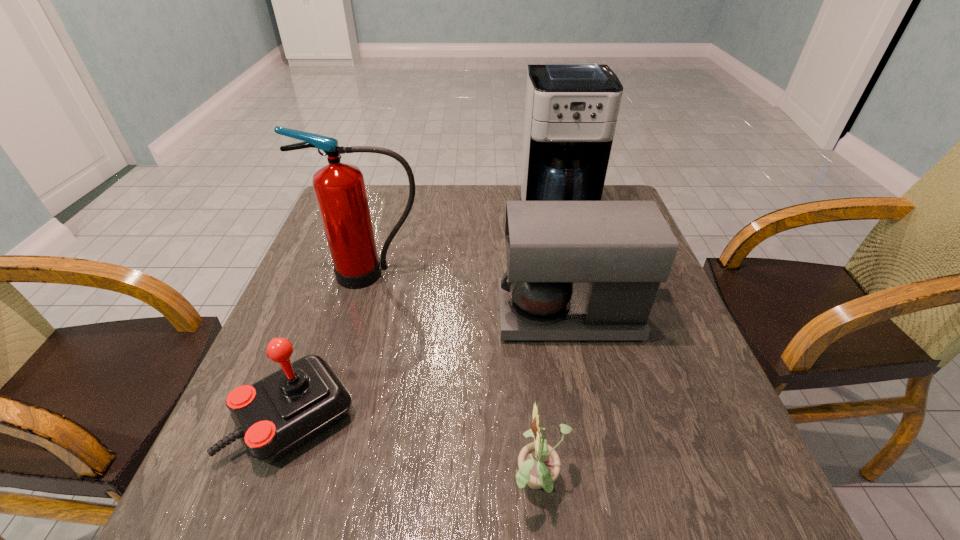
I want to click on joystick located at the left edge, so click(274, 416).

The image size is (960, 540). I want to click on object positioned at the near left corner, so click(274, 416).

At what (x,y) coordinates should I click in order to perform the action: click on object present at the far right corner. Please return your answer as a coordinate pair (x, y). The image size is (960, 540). Looking at the image, I should click on (571, 108).

Find the location of a particular element. Image resolution: width=960 pixels, height=540 pixels. free location at the far edge is located at coordinates (452, 216).

This screenshot has height=540, width=960. I want to click on vacant region at the near edge of the desktop, so click(567, 523).

Identify the location of vacant space at the left edge. (375, 228).

Locate an element on the screen. The image size is (960, 540). vacant space at the right edge of the desktop is located at coordinates (707, 453).

This screenshot has width=960, height=540. What are the coordinates of `free point between the third nearest object and the sunflower` in the screenshot? It's located at (554, 400).

The image size is (960, 540). Find the location of `vacant area that lies between the sunflower and the joystick`. vacant area that lies between the sunflower and the joystick is located at coordinates (418, 450).

Locate an element on the screen. This screenshot has width=960, height=540. vacant area that lies between the joystick and the fourth nearest object is located at coordinates (334, 345).